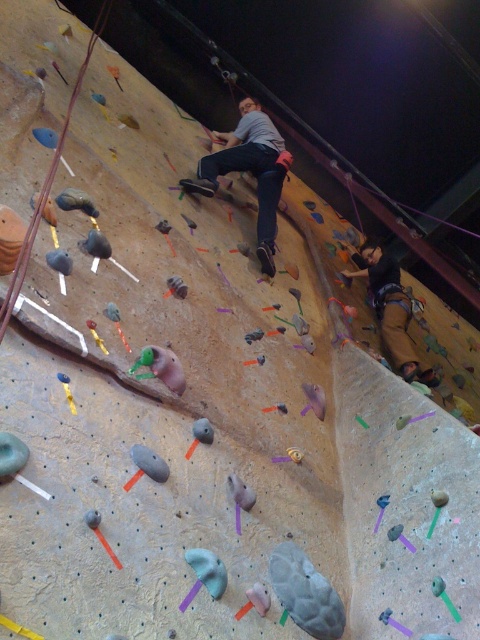
You are a photographer setting up a camera to capture the climber. You notice the gray matte shirt at center and the brown leather pants at lower right. Which clothing item has a wider appearance in the photo?

The gray matte shirt at center has a wider appearance than the brown leather pants at lower right because its width is larger according to the description.

You are a photographer positioned at the base of the climbing wall. You want to take a photo that includes both the gray matte shirt at center and the brown leather pants at lower right. Based on their positions, which object will appear larger in the photo?

The gray matte shirt at center will appear larger in the photo because it has a greater height compared to the brown leather pants at lower right.